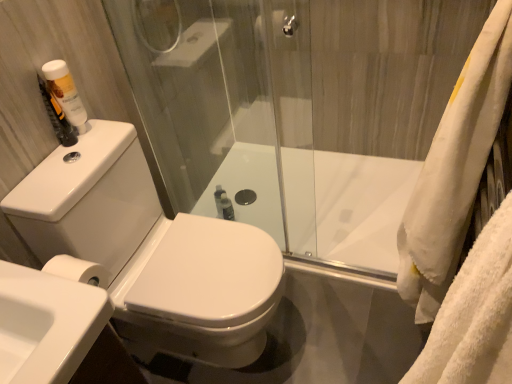
Image resolution: width=512 pixels, height=384 pixels. In order to click on vacant area located to the right-hand side of white glossy toilet at center in this screenshot , I will do `click(333, 298)`.